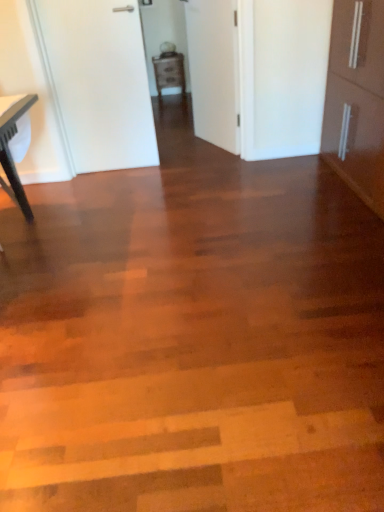
Question: Is matte brown cabinet at center completely or partially inside white matte door at upper left, marked as the second door in a right-to-left arrangement?

Choices:
 (A) no
 (B) yes

Answer: (A)

Question: Is white matte door at upper left, the 1th door from the left, to the left of matte brown cabinet at center from the viewer's perspective?

Choices:
 (A) yes
 (B) no

Answer: (A)

Question: Is white matte door at upper left, marked as the second door in a right-to-left arrangement, touching matte brown cabinet at center?

Choices:
 (A) yes
 (B) no

Answer: (B)

Question: From a real-world perspective, is white matte door at upper left, marked as the second door in a right-to-left arrangement, physically above matte brown cabinet at center?

Choices:
 (A) no
 (B) yes

Answer: (B)

Question: Is white matte door at upper left, the 1th door from the left, smaller than matte brown cabinet at center?

Choices:
 (A) no
 (B) yes

Answer: (B)

Question: Is white matte door at upper left, the 1th door from the left, wider or thinner than matte brown cabinet at center?

Choices:
 (A) wide
 (B) thin

Answer: (B)

Question: In terms of size, does white matte door at upper left, marked as the second door in a right-to-left arrangement, appear bigger or smaller than matte brown cabinet at center?

Choices:
 (A) small
 (B) big

Answer: (A)

Question: Considering their positions, is white matte door at upper left, marked as the second door in a right-to-left arrangement, located in front of or behind matte brown cabinet at center?

Choices:
 (A) front
 (B) behind

Answer: (A)

Question: Would you say white matte door at upper left, marked as the second door in a right-to-left arrangement, is to the left or to the right of matte brown cabinet at center in the picture?

Choices:
 (A) right
 (B) left

Answer: (B)

Question: Is white matte door at upper left, marked as the second door in a right-to-left arrangement, taller or shorter than white matte door at center, which is the first door from right to left?

Choices:
 (A) short
 (B) tall

Answer: (B)

Question: From the image's perspective, is white matte door at upper left, the 1th door from the left, above or below white matte door at center, which is the first door from right to left?

Choices:
 (A) above
 (B) below

Answer: (B)

Question: Is white matte door at upper left, the 1th door from the left, to the left or to the right of white matte door at center, which is the first door from right to left, in the image?

Choices:
 (A) right
 (B) left

Answer: (B)

Question: Considering their positions, is white matte door at upper left, marked as the second door in a right-to-left arrangement, located in front of or behind white matte door at center, which is the first door from right to left?

Choices:
 (A) front
 (B) behind

Answer: (A)

Question: In terms of width, does white matte door at center, which ranks as the 2th door in left-to-right order, look wider or thinner when compared to matte black table at left?

Choices:
 (A) thin
 (B) wide

Answer: (A)

Question: Does point (221, 45) appear closer or farther from the camera than point (8, 154)?

Choices:
 (A) farther
 (B) closer

Answer: (A)